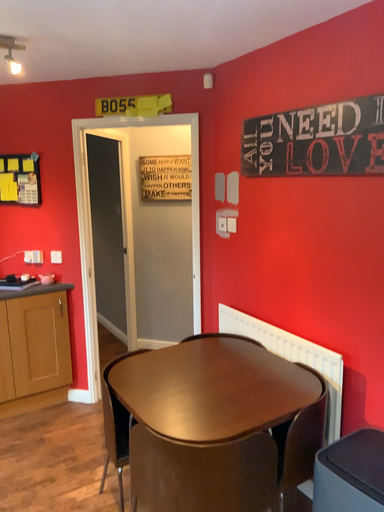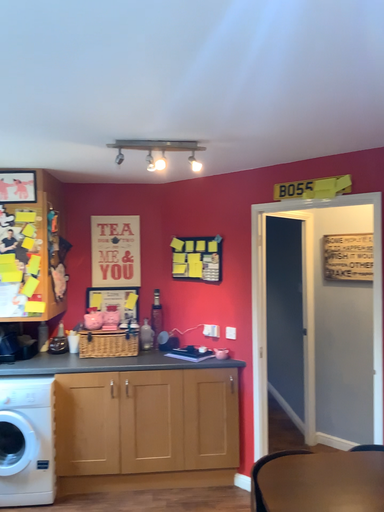
Question: Which way did the camera rotate in the video?

Choices:
 (A) rotated downward
 (B) rotated upward

Answer: (B)